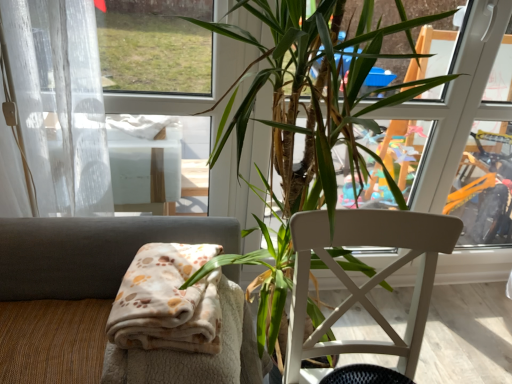
At what (x,y) coordinates should I click in order to perform the action: click on white sheer curtain at left. Please return your answer as a coordinate pair (x, y). Looking at the image, I should click on point(54,111).

Image resolution: width=512 pixels, height=384 pixels. Describe the element at coordinates (54, 111) in the screenshot. I see `white sheer curtain at left` at that location.

The height and width of the screenshot is (384, 512). Describe the element at coordinates (307, 124) in the screenshot. I see `green leafy plant at center` at that location.

I want to click on white sheer curtain at left, so click(x=54, y=111).

Can you confirm if white sheer curtain at left is positioned to the right of green leafy plant at center?

No.

This screenshot has width=512, height=384. Find the location of `curtain above the green leafy plant at center (from the image's perspective)`. curtain above the green leafy plant at center (from the image's perspective) is located at coordinates (54, 111).

Consider the image. Is green leafy plant at center inside white sheer curtain at left?

No, green leafy plant at center is not inside white sheer curtain at left.

Is white sheer curtain at left positioned far away from green leafy plant at center?

No.

Is beige fabric chair at lower left, the 2th chair when ordered from right to left, inside the boundaries of white wood chair at center, which is counted as the first chair, starting from the right, or outside?

beige fabric chair at lower left, the 2th chair when ordered from right to left, is not inside white wood chair at center, which is counted as the first chair, starting from the right, it's outside.

Does beige fabric chair at lower left, the 2th chair when ordered from right to left, appear on the left side of white wood chair at center, which appears as the second chair when viewed from the left?

Indeed, beige fabric chair at lower left, the 2th chair when ordered from right to left, is positioned on the left side of white wood chair at center, which appears as the second chair when viewed from the left.

How many degrees apart are the facing directions of beige fabric chair at lower left, the 2th chair when ordered from right to left, and white wood chair at center, which is counted as the first chair, starting from the right?

The facing directions of beige fabric chair at lower left, the 2th chair when ordered from right to left, and white wood chair at center, which is counted as the first chair, starting from the right, are 1.1 degrees apart.

Between beige fabric chair at lower left, the 1th chair viewed from the left, and white wood chair at center, which appears as the second chair when viewed from the left, which one has larger size?

white wood chair at center, which appears as the second chair when viewed from the left.

Consider the image. Does green leafy plant at center have a greater width compared to white sheer curtain at left?

Correct, the width of green leafy plant at center exceeds that of white sheer curtain at left.

From a real-world perspective, which is physically above, green leafy plant at center or white sheer curtain at left?

white sheer curtain at left is physically above.

Considering the relative sizes of green leafy plant at center and white sheer curtain at left in the image provided, is green leafy plant at center taller than white sheer curtain at left?

Yes.

Is green leafy plant at center inside or outside of white sheer curtain at left?

green leafy plant at center exists outside the volume of white sheer curtain at left.

How different are the orientations of white wood chair at center, which appears as the second chair when viewed from the left, and white sheer curtain at left in degrees?

The angle between the facing direction of white wood chair at center, which appears as the second chair when viewed from the left, and the facing direction of white sheer curtain at left is 0.00033 degrees.

Is white wood chair at center, which is counted as the first chair, starting from the right, behind white sheer curtain at left?

No, white wood chair at center, which is counted as the first chair, starting from the right, is in front of white sheer curtain at left.

Based on the photo, is white wood chair at center, which appears as the second chair when viewed from the left, not inside white sheer curtain at left?

Yes, white wood chair at center, which appears as the second chair when viewed from the left, is located beyond the bounds of white sheer curtain at left.

Does point (410, 370) come closer to viewer compared to point (19, 21)?

Yes.

Locate an element on the screen. This screenshot has width=512, height=384. chair lying on the right of beige fabric chair at lower left, the 1th chair viewed from the left is located at coordinates (366, 282).

Based on the photo, between white wood chair at center, which appears as the second chair when viewed from the left, and beige fabric chair at lower left, the 1th chair viewed from the left, which one has larger width?

beige fabric chair at lower left, the 1th chair viewed from the left, is wider.

From a real-world perspective, who is located higher, white wood chair at center, which appears as the second chair when viewed from the left, or beige fabric chair at lower left, the 1th chair viewed from the left?

beige fabric chair at lower left, the 1th chair viewed from the left.

Looking at this image, considering the relative sizes of white wood chair at center, which appears as the second chair when viewed from the left, and beige fabric chair at lower left, the 2th chair when ordered from right to left, in the image provided, is white wood chair at center, which appears as the second chair when viewed from the left, smaller than beige fabric chair at lower left, the 2th chair when ordered from right to left,?

No, white wood chair at center, which appears as the second chair when viewed from the left, is not smaller than beige fabric chair at lower left, the 2th chair when ordered from right to left.

Is white sheer curtain at left in contact with white wood chair at center, which is counted as the first chair, starting from the right?

No, white sheer curtain at left is not next to white wood chair at center, which is counted as the first chair, starting from the right.

Is white sheer curtain at left facing away from white wood chair at center, which appears as the second chair when viewed from the left?

No, white sheer curtain at left is not facing the opposite direction of white wood chair at center, which appears as the second chair when viewed from the left.

From the image's perspective, count 2nd chairs downward from the white sheer curtain at left and point to it. Please provide its 2D coordinates.

[(366, 282)]

From a real-world perspective, who is located lower, beige fabric chair at lower left, the 1th chair viewed from the left, or green leafy plant at center?

From a 3D spatial view, beige fabric chair at lower left, the 1th chair viewed from the left, is below.

Who is smaller, beige fabric chair at lower left, the 1th chair viewed from the left, or green leafy plant at center?

beige fabric chair at lower left, the 1th chair viewed from the left, is smaller.

Can we say beige fabric chair at lower left, the 2th chair when ordered from right to left, lies outside green leafy plant at center?

Actually, beige fabric chair at lower left, the 2th chair when ordered from right to left, is at least partially inside green leafy plant at center.

From the image's perspective, is beige fabric chair at lower left, the 2th chair when ordered from right to left, positioned above or below green leafy plant at center?

From the image's perspective, beige fabric chair at lower left, the 2th chair when ordered from right to left, appears below green leafy plant at center.

This screenshot has height=384, width=512. I want to click on curtain on the left of the green leafy plant at center, so click(54, 111).

Find the location of a particular element. The image size is (512, 384). chair above the white wood chair at center, which is counted as the first chair, starting from the right (from the image's perspective) is located at coordinates (75, 286).

Looking at the image, which one is located closer to beige fabric chair at lower left, the 1th chair viewed from the left, green leafy plant at center or white sheer curtain at left?

white sheer curtain at left is positioned closer to the anchor beige fabric chair at lower left, the 1th chair viewed from the left.

When comparing their distances from white wood chair at center, which is counted as the first chair, starting from the right, does white sheer curtain at left or green leafy plant at center seem further?

white sheer curtain at left lies further to white wood chair at center, which is counted as the first chair, starting from the right, than the other object.

Based on their spatial positions, is beige fabric chair at lower left, the 2th chair when ordered from right to left, or green leafy plant at center further from white sheer curtain at left?

green leafy plant at center is further to white sheer curtain at left.

Which object lies nearer to the anchor point white sheer curtain at left, beige fabric chair at lower left, the 1th chair viewed from the left, or white wood chair at center, which is counted as the first chair, starting from the right?

Based on the image, beige fabric chair at lower left, the 1th chair viewed from the left, appears to be nearer to white sheer curtain at left.

Which object lies further to the anchor point white sheer curtain at left, white wood chair at center, which is counted as the first chair, starting from the right, or beige fabric chair at lower left, the 2th chair when ordered from right to left?

white wood chair at center, which is counted as the first chair, starting from the right, lies further to white sheer curtain at left than the other object.

From the image, which object appears to be nearer to green leafy plant at center, white sheer curtain at left or beige fabric chair at lower left, the 1th chair viewed from the left?

The object closer to green leafy plant at center is beige fabric chair at lower left, the 1th chair viewed from the left.

From the image, which object appears to be farther from beige fabric chair at lower left, the 1th chair viewed from the left, white wood chair at center, which appears as the second chair when viewed from the left, or green leafy plant at center?

Among the two, white wood chair at center, which appears as the second chair when viewed from the left, is located further to beige fabric chair at lower left, the 1th chair viewed from the left.

Looking at the image, which one is located closer to white wood chair at center, which is counted as the first chair, starting from the right, beige fabric chair at lower left, the 1th chair viewed from the left, or white sheer curtain at left?

The object closer to white wood chair at center, which is counted as the first chair, starting from the right, is beige fabric chair at lower left, the 1th chair viewed from the left.

I want to click on chair between white sheer curtain at left and white wood chair at center, which is counted as the first chair, starting from the right, so click(75, 286).

I want to click on houseplant between white sheer curtain at left and white wood chair at center, which is counted as the first chair, starting from the right, in the horizontal direction, so click(307, 124).

In order to click on houseplant between beige fabric chair at lower left, the 2th chair when ordered from right to left, and white wood chair at center, which is counted as the first chair, starting from the right in this screenshot , I will do `click(307, 124)`.

Locate an element on the screen. Image resolution: width=512 pixels, height=384 pixels. chair between white sheer curtain at left and green leafy plant at center in the horizontal direction is located at coordinates (75, 286).